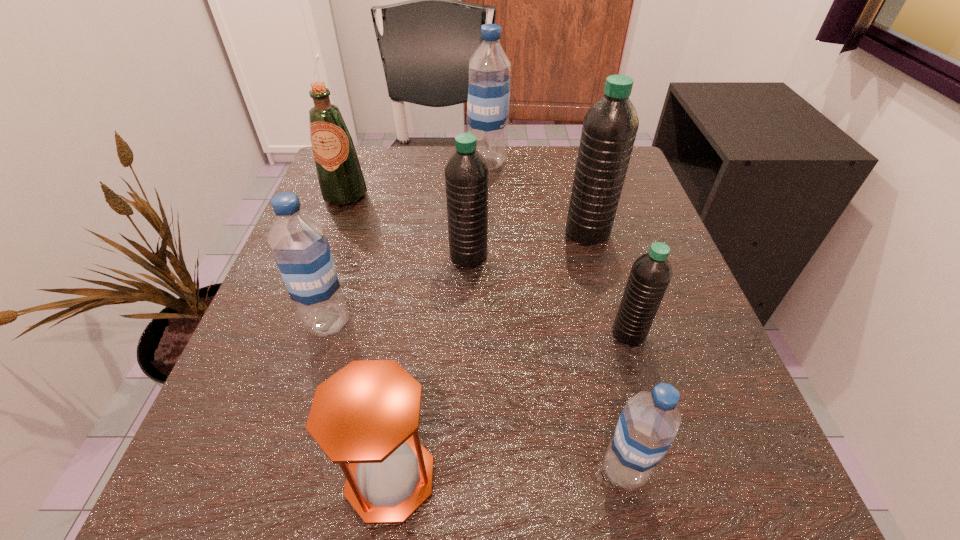
Locate an element on the screen. The height and width of the screenshot is (540, 960). water bottle that is at the left edge is located at coordinates (298, 242).

Where is `object at the far left corner`? object at the far left corner is located at coordinates (340, 177).

Find the location of `object that is at the near right corner`. object that is at the near right corner is located at coordinates (648, 424).

Where is `free space at the far edge of the desktop`? The height and width of the screenshot is (540, 960). free space at the far edge of the desktop is located at coordinates (542, 163).

The image size is (960, 540). What are the coordinates of `free point at the near edge` in the screenshot? It's located at (318, 516).

Identify the location of free region at the left edge. This screenshot has width=960, height=540. coord(338,264).

Where is `free space at the far left corner of the desktop`? The image size is (960, 540). free space at the far left corner of the desktop is located at coordinates (393, 151).

This screenshot has height=540, width=960. Identify the location of vacant space at the near left corner of the desktop. (317, 452).

Where is `free space at the near right corner`? This screenshot has height=540, width=960. free space at the near right corner is located at coordinates [739, 507].

At what (x,y) coordinates should I click in order to perform the action: click on vacant area that lies between the hourglass and the smallest black water bottle. Please return your answer as a coordinate pair (x, y). The image size is (960, 540). Looking at the image, I should click on (510, 406).